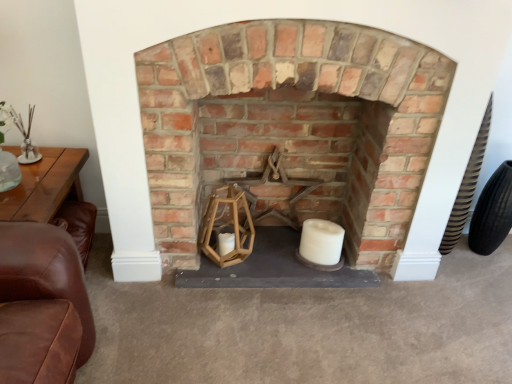
Question: Can you see rustic brick fireplace at center touching white matte candle at center?

Choices:
 (A) yes
 (B) no

Answer: (B)

Question: Is white matte candle at center at the back of rustic brick fireplace at center?

Choices:
 (A) yes
 (B) no

Answer: (A)

Question: Does rustic brick fireplace at center turn towards white matte candle at center?

Choices:
 (A) no
 (B) yes

Answer: (B)

Question: Is rustic brick fireplace at center at the right side of white matte candle at center?

Choices:
 (A) no
 (B) yes

Answer: (A)

Question: Is rustic brick fireplace at center bigger than white matte candle at center?

Choices:
 (A) yes
 (B) no

Answer: (A)

Question: Would you consider rustic brick fireplace at center to be distant from white matte candle at center?

Choices:
 (A) no
 (B) yes

Answer: (A)

Question: Can you confirm if white matte candle at center is positioned to the right of black rubber tire at right?

Choices:
 (A) yes
 (B) no

Answer: (B)

Question: From the image's perspective, is white matte candle at center above black rubber tire at right?

Choices:
 (A) no
 (B) yes

Answer: (A)

Question: Is white matte candle at center positioned in front of black rubber tire at right?

Choices:
 (A) no
 (B) yes

Answer: (B)

Question: From a real-world perspective, does white matte candle at center stand above black rubber tire at right?

Choices:
 (A) yes
 (B) no

Answer: (B)

Question: Is white matte candle at center aimed at black rubber tire at right?

Choices:
 (A) no
 (B) yes

Answer: (A)

Question: Can you confirm if white matte candle at center is shorter than black rubber tire at right?

Choices:
 (A) yes
 (B) no

Answer: (A)

Question: Does white matte candle at center have a greater height compared to rustic brick fireplace at center?

Choices:
 (A) yes
 (B) no

Answer: (B)